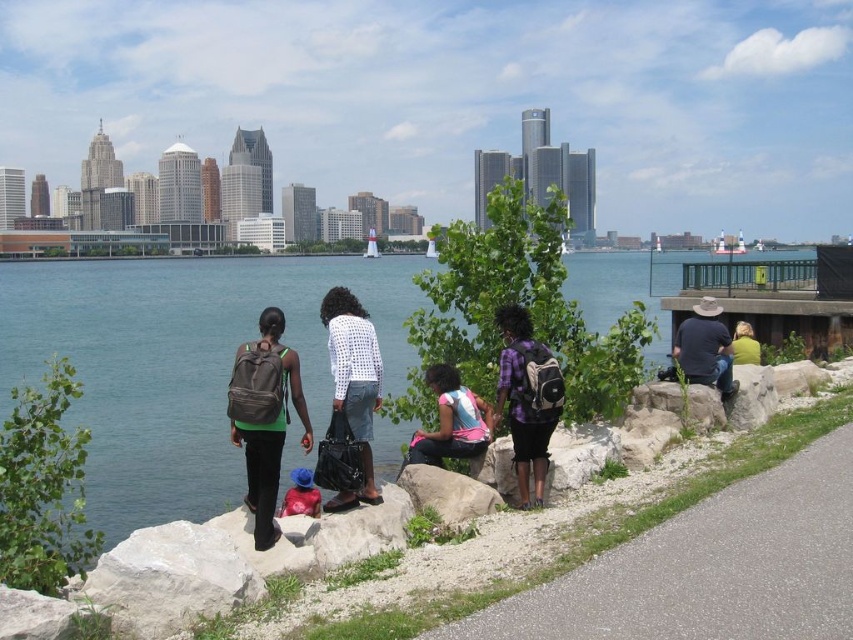
Is point (286, 369) positioned after point (755, 342)?

No, (286, 369) is in front of (755, 342).

Describe the element at coordinates (267, 426) in the screenshot. I see `matte brown backpack at center-left` at that location.

Which is behind, point (265, 330) or point (747, 323)?

The point (747, 323) is more distant.

What are the coordinates of `matte brown backpack at center-left` in the screenshot? It's located at (267, 426).

Is denim jacket at lower right below yellow fabric at upper right?

No.

The width and height of the screenshot is (853, 640). What are the coordinates of `denim jacket at lower right` in the screenshot? It's located at (705, 348).

Can you confirm if gray rough rock at lower center is bigger than yellow fabric at upper right?

No, gray rough rock at lower center is not bigger than yellow fabric at upper right.

Measure the distance between gray rough rock at lower center and yellow fabric at upper right.

gray rough rock at lower center and yellow fabric at upper right are 35.34 meters apart.

The width and height of the screenshot is (853, 640). Identify the location of gray rough rock at lower center. (447, 493).